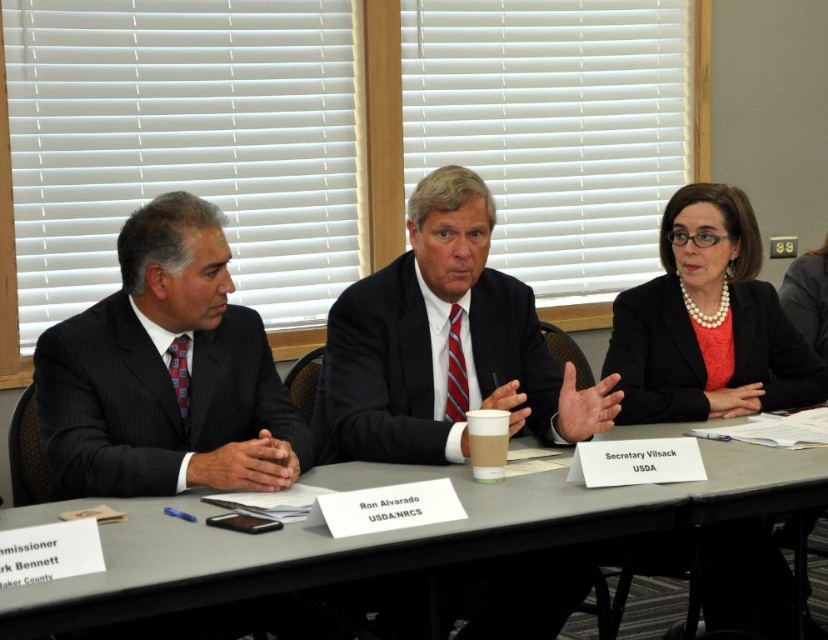
You are organizing a photo shoot and need to place two suits on a table. The black suit at center and the pinstriped suit at left must be arranged so that the wider suit is on the left side. Based on the image, which suit should you place on the left?

The black suit at center is wider than the pinstriped suit at left, so you should place the black suit at center on the left side to follow the requirement.

You are attending a meeting and need to pass a document to the person wearing the pearl necklace at upper right. Which direction should you move to reach them first, considering the black suit at center is in your way?

The black suit at center is closer to you than the pearl necklace at upper right, so you should move around the black suit at center to reach the pearl necklace at upper right.

You are a photographer setting up for a group photo. You need to position a backdrop behind the gray plastic table at center without blocking the black suit at center. Is this possible based on the current arrangement?

The gray plastic table at center is behind the black suit at center, so placing a backdrop behind the table would also place it behind the black suit at center. This might block the view of the black suit at center, so it might not be possible without adjusting their positions.